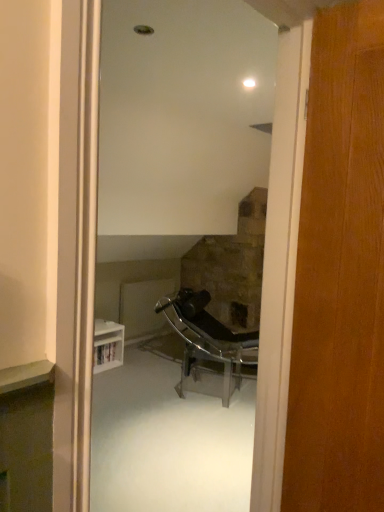
Question: From their relative heights in the image, would you say wooden door at right is taller or shorter than metallic chrome chair at center?

Choices:
 (A) tall
 (B) short

Answer: (A)

Question: Considering the positions of wooden door at right and metallic chrome chair at center in the image, is wooden door at right bigger or smaller than metallic chrome chair at center?

Choices:
 (A) big
 (B) small

Answer: (B)

Question: From the image's perspective, relative to metallic chrome chair at center, is wooden door at right above or below?

Choices:
 (A) below
 (B) above

Answer: (B)

Question: Considering their positions, is metallic chrome chair at center located in front of or behind wooden door at right?

Choices:
 (A) behind
 (B) front

Answer: (A)

Question: Would you say metallic chrome chair at center is to the left or to the right of wooden door at right in the picture?

Choices:
 (A) left
 (B) right

Answer: (A)

Question: From a real-world perspective, relative to wooden door at right, is metallic chrome chair at center vertically above or below?

Choices:
 (A) below
 (B) above

Answer: (A)

Question: Is metallic chrome chair at center spatially inside wooden door at right, or outside of it?

Choices:
 (A) outside
 (B) inside

Answer: (A)